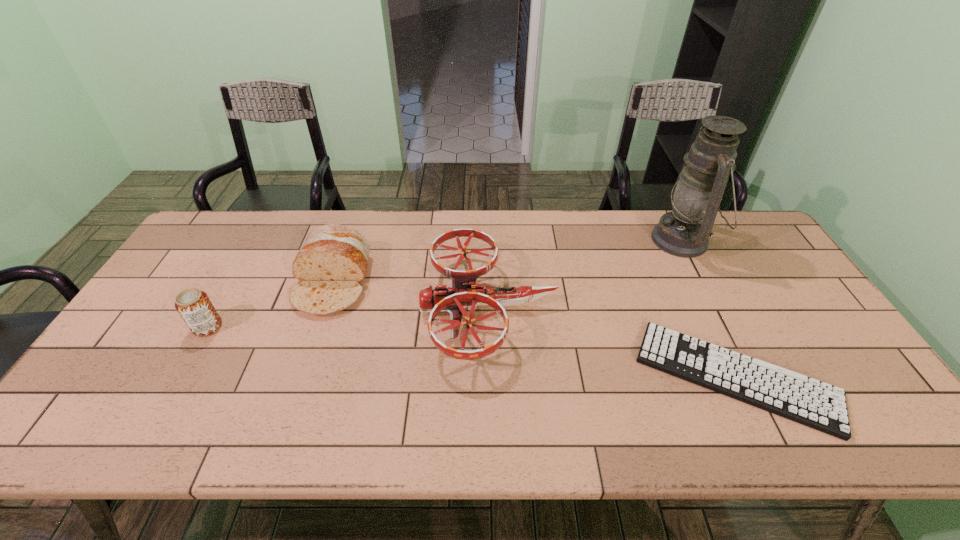
Find the location of `oil lamp`. oil lamp is located at coordinates (697, 194).

At what (x,y) coordinates should I click in order to perform the action: click on the fourth object from right to left. Please return your answer as a coordinate pair (x, y). Looking at the image, I should click on (331, 263).

This screenshot has height=540, width=960. Identify the location of the leftmost object. (194, 306).

You are a GUI agent. You are given a task and a screenshot of the screen. Output one action in this format:
    pyautogui.click(x=<x>, y=<y>)
    Task: Click on the third object from right to left
    This screenshot has width=960, height=540.
    Given the screenshot: What is the action you would take?
    pyautogui.click(x=463, y=293)

The height and width of the screenshot is (540, 960). In order to click on the shortest object in this screenshot , I will do `click(818, 405)`.

At what (x,y) coordinates should I click in order to perform the action: click on vacant space situated on the front of the oil lamp. Please return your answer as a coordinate pair (x, y). Looking at the image, I should click on (739, 350).

Locate an element on the screen. Image resolution: width=960 pixels, height=540 pixels. vacant region located 0.210m at the sliced end of the bread is located at coordinates (298, 386).

Where is `free location located on the back of the beer can`? This screenshot has width=960, height=540. free location located on the back of the beer can is located at coordinates (250, 254).

The image size is (960, 540). I want to click on vacant area located 0.140m on the left of the third object from left to right, so click(x=371, y=308).

At what (x,y) coordinates should I click in order to perform the action: click on vacant space located 0.090m on the left of the shortest object. Please return your answer as a coordinate pair (x, y). The image size is (960, 540). Looking at the image, I should click on (604, 376).